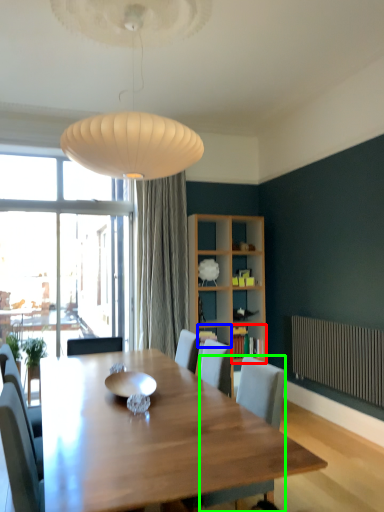
Question: Which is farther away from shelf (highlighted by a red box)? shelf (highlighted by a blue box) or chair (highlighted by a green box)?

Choices:
 (A) shelf
 (B) chair

Answer: (B)